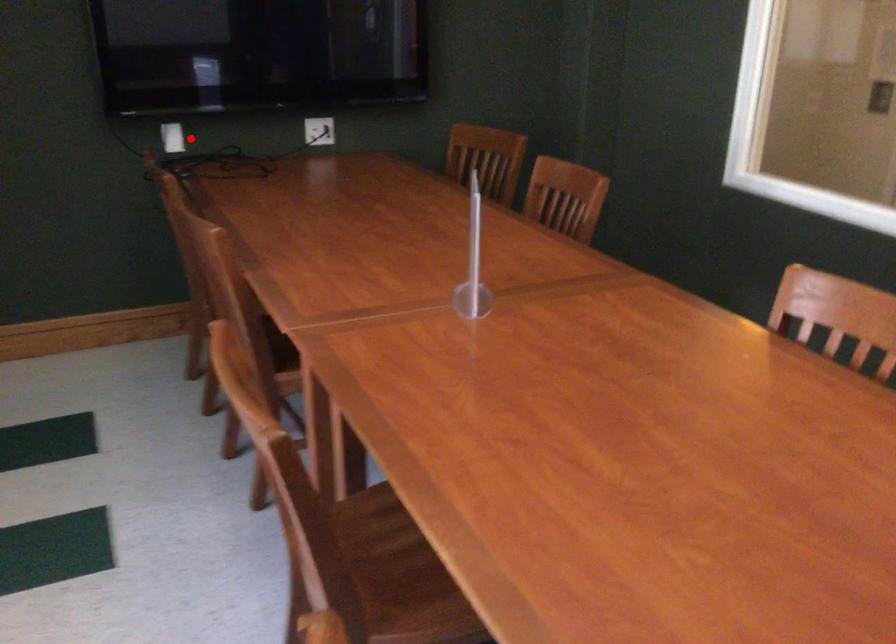
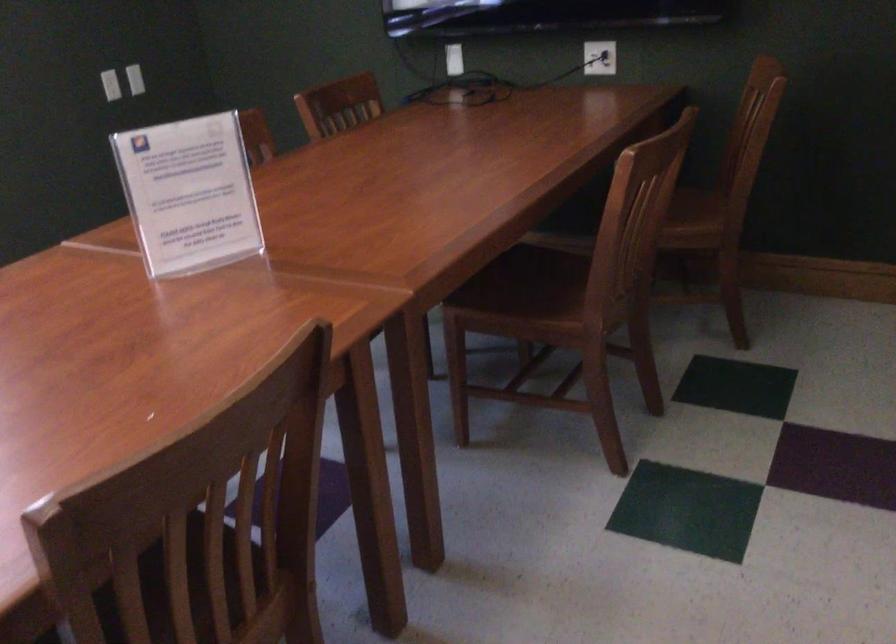
The point at the highlighted location is marked in the first image. Where is the corresponding point in the second image?

(453, 59)